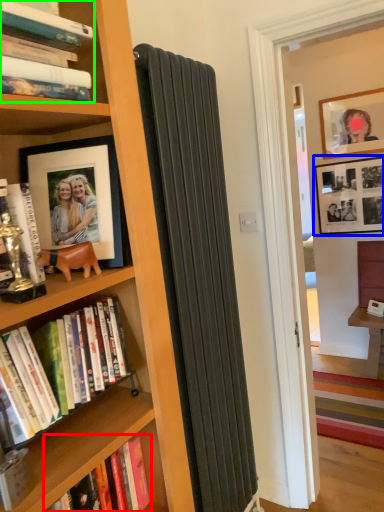
Question: Which object is the closest to the book (highlighted by a red box)? Choose among these: picture frame (highlighted by a blue box) or book (highlighted by a green box).

Choices:
 (A) picture frame
 (B) book

Answer: (B)